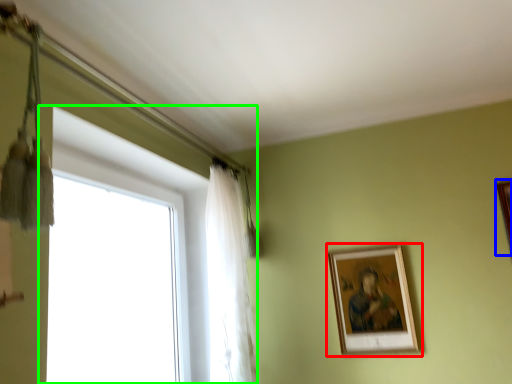
Question: Based on their relative distances, which object is farther from picture frame (highlighted by a red box)? Choose from picture frame (highlighted by a blue box) and window (highlighted by a green box).

Choices:
 (A) picture frame
 (B) window

Answer: (B)